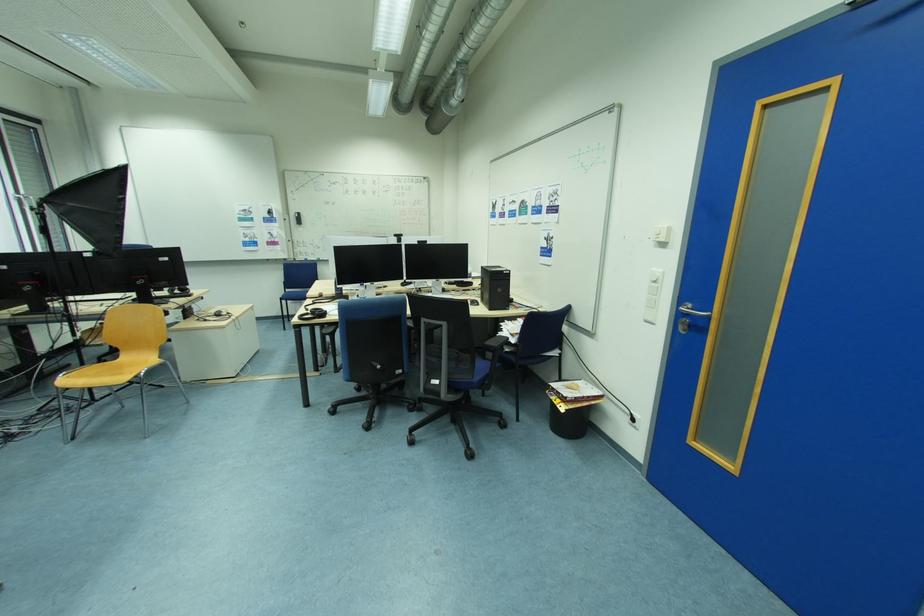
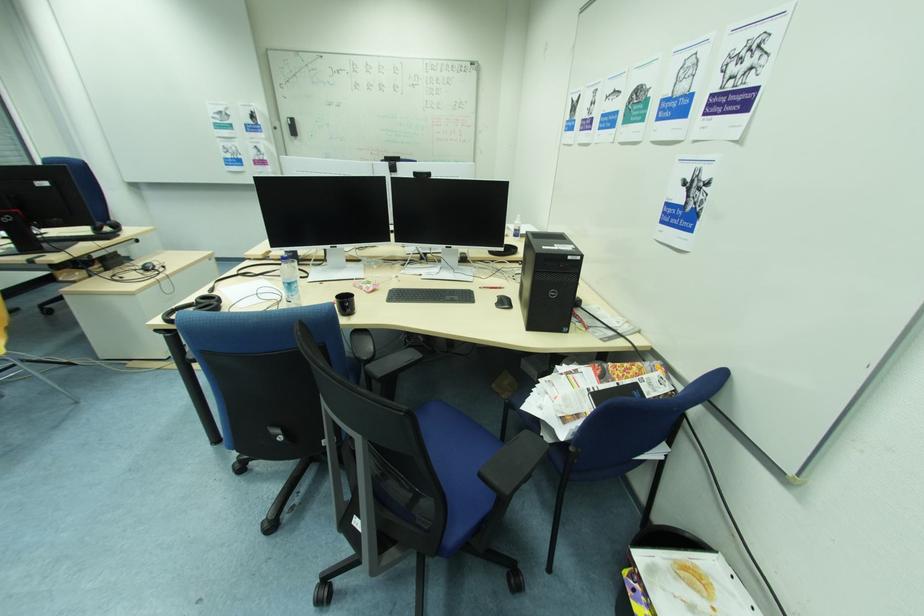
Question: The images are taken continuously from a first-person perspective. In which direction are you moving?

Choices:
 (A) Left
 (B) Right
 (C) Forward
 (D) Backward

Answer: (C)